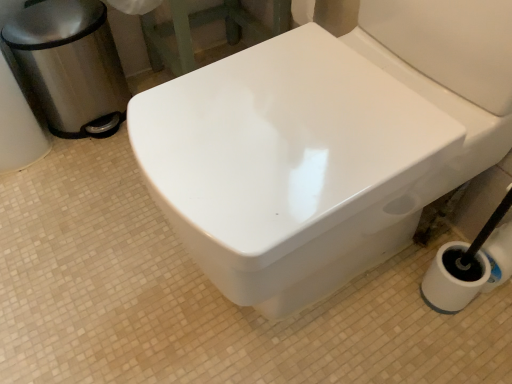
Question: Is polished stainless steel trash can at left with white glossy bidet at center?

Choices:
 (A) yes
 (B) no

Answer: (B)

Question: From the image's perspective, is polished stainless steel trash can at left above white glossy bidet at center?

Choices:
 (A) yes
 (B) no

Answer: (A)

Question: Can you confirm if polished stainless steel trash can at left is bigger than white glossy bidet at center?

Choices:
 (A) yes
 (B) no

Answer: (B)

Question: Is polished stainless steel trash can at left not near white glossy bidet at center?

Choices:
 (A) yes
 (B) no

Answer: (B)

Question: Is polished stainless steel trash can at left at the right side of white glossy bidet at center?

Choices:
 (A) yes
 (B) no

Answer: (B)

Question: Would you say white glossy bidet at center is part of polished stainless steel trash can at left's contents?

Choices:
 (A) no
 (B) yes

Answer: (A)

Question: Does white glossy bidet at center appear on the right side of polished stainless steel trash can at left?

Choices:
 (A) no
 (B) yes

Answer: (B)

Question: Is white glossy bidet at center bigger than polished stainless steel trash can at left?

Choices:
 (A) yes
 (B) no

Answer: (A)

Question: Does white glossy bidet at center turn towards polished stainless steel trash can at left?

Choices:
 (A) no
 (B) yes

Answer: (A)

Question: From the image's perspective, is white glossy bidet at center beneath polished stainless steel trash can at left?

Choices:
 (A) yes
 (B) no

Answer: (A)

Question: Is white glossy bidet at center closer to the viewer compared to polished stainless steel trash can at left?

Choices:
 (A) no
 (B) yes

Answer: (B)

Question: Is white glossy bidet at center at the left side of polished stainless steel trash can at left?

Choices:
 (A) yes
 (B) no

Answer: (B)

Question: From their relative heights in the image, would you say polished stainless steel trash can at left is taller or shorter than white glossy bidet at center?

Choices:
 (A) short
 (B) tall

Answer: (A)